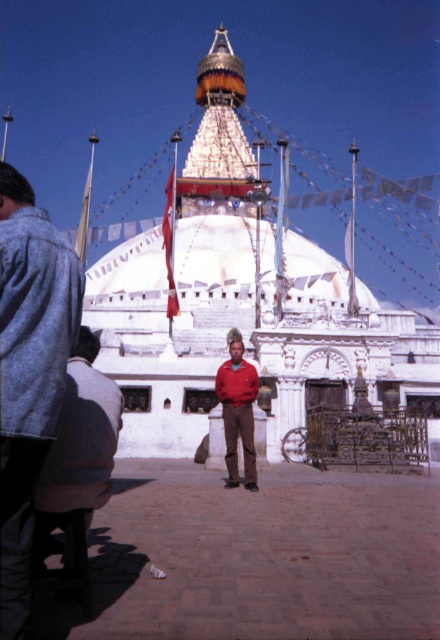
Question: Can you confirm if brushed denim jacket at lower left is positioned above red matte jacket at center?

Choices:
 (A) no
 (B) yes

Answer: (B)

Question: Based on their relative distances, which object is farther from the red jacket at center?

Choices:
 (A) brushed denim jacket at lower left
 (B) red matte jacket at center

Answer: (B)

Question: Can you confirm if brushed denim jacket at lower left is smaller than red matte jacket at center?

Choices:
 (A) yes
 (B) no

Answer: (B)

Question: Among these objects, which one is farthest from the camera?

Choices:
 (A) brushed denim jacket at lower left
 (B) red matte jacket at center

Answer: (B)

Question: Considering the real-world distances, which object is closest to the red jacket at center?

Choices:
 (A) red matte jacket at center
 (B) brushed denim jacket at lower left

Answer: (B)

Question: Is red jacket at center thinner than red matte jacket at center?

Choices:
 (A) yes
 (B) no

Answer: (B)